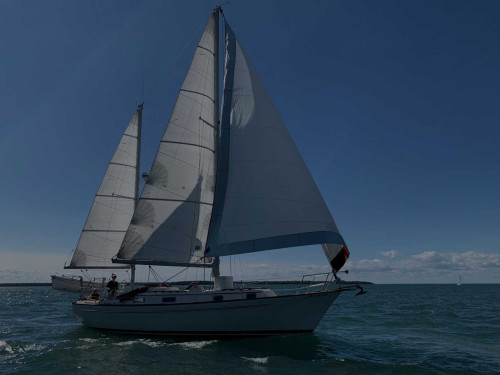
Where is `sheets`? The image size is (500, 375). sheets is located at coordinates (156, 276), (86, 274).